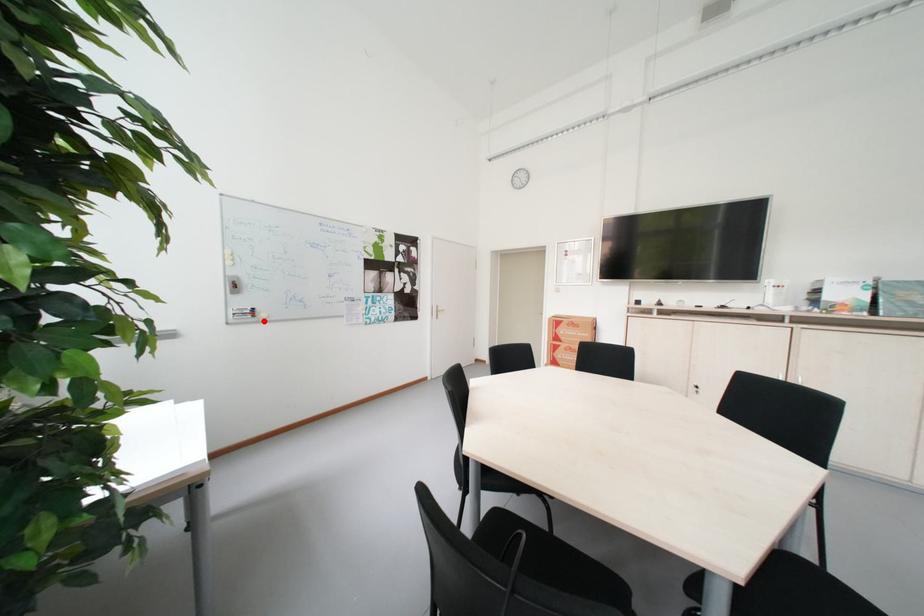
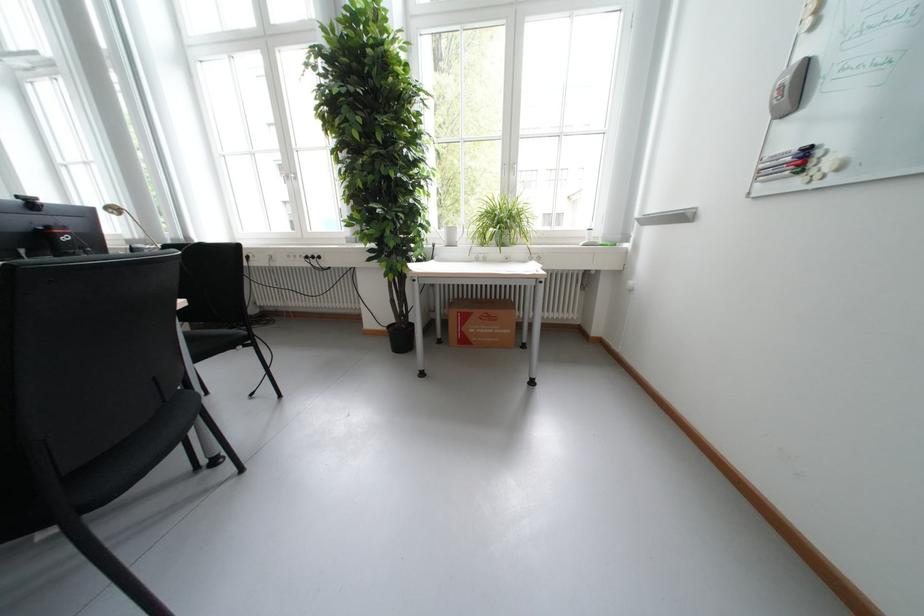
Find the pixel in the second image that matches the highlighted location in the first image.

(806, 184)